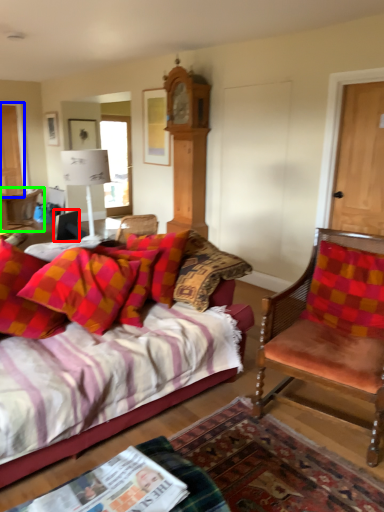
Question: Based on their relative distances, which object is nearer to corded phone (highlighted by a red box)? Choose from door (highlighted by a blue box) and chair (highlighted by a green box).

Choices:
 (A) door
 (B) chair

Answer: (B)